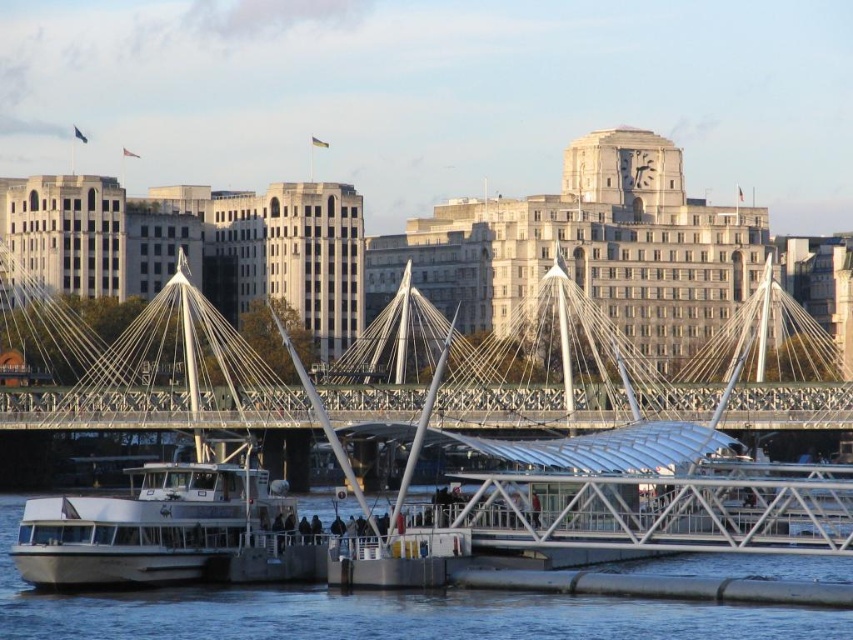
From the picture: You are standing on the pier and see the clear water at lower center and the white matte boat at lower left. Which object is positioned lower in the scene?

The clear water at lower center is located below the white matte boat at lower left, so it is positioned lower in the scene.

You are a construction worker tasked with installing a safety net between the clear water at lower center and the suspension bridge in the midground. The net must span the distance between them. If the safety net material you have can only stretch up to 250 feet, will it be sufficient?

The distance between the clear water at lower center and the suspension bridge in the midground is 268.75 feet, which exceeds the 250 feet capacity of the safety net material. Therefore, the net will not be sufficient to cover the gap.

In the scene shown: You are standing on the pier and looking towards the suspension bridge. You notice the clear water at lower center and the white matte boat at lower left. Which object is closer to the water surface?

The clear water at lower center has a lesser height compared to the white matte boat at lower left, so the clear water at lower center is closer to the water surface.